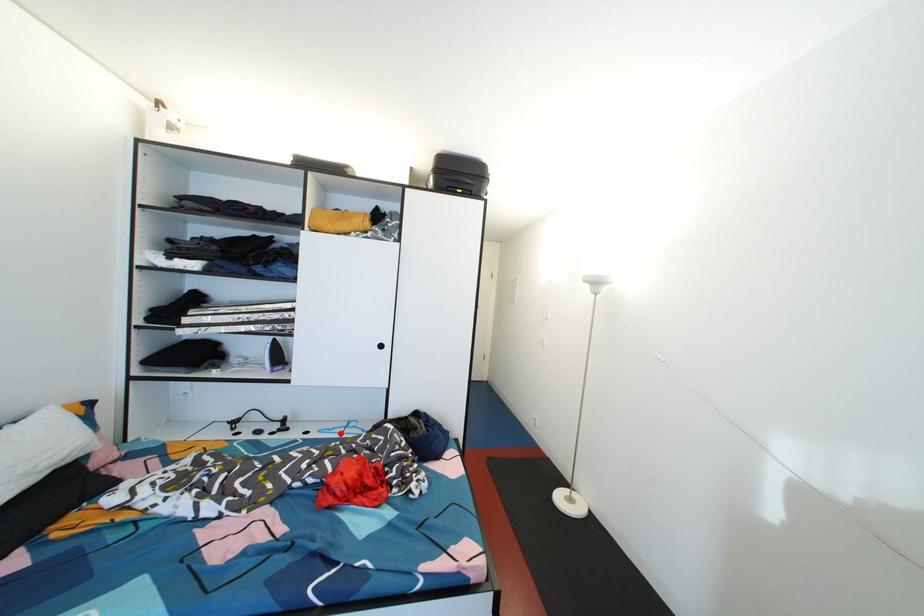
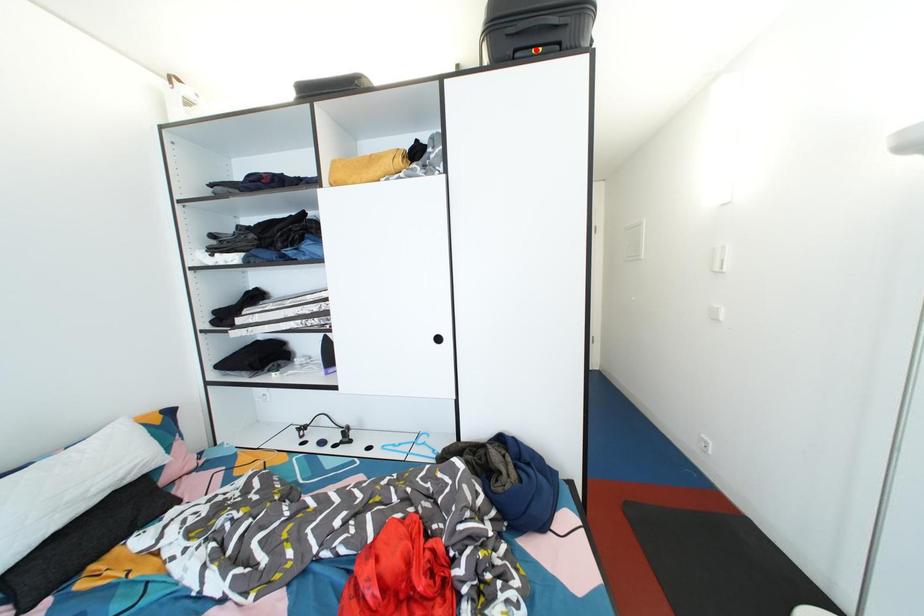
I am providing you with two images of the same scene from different viewpoints. A red point is marked on the first image and another point is marked on the second image. Do the highlighted points in image1 and image2 indicate the same real-world spot?

No